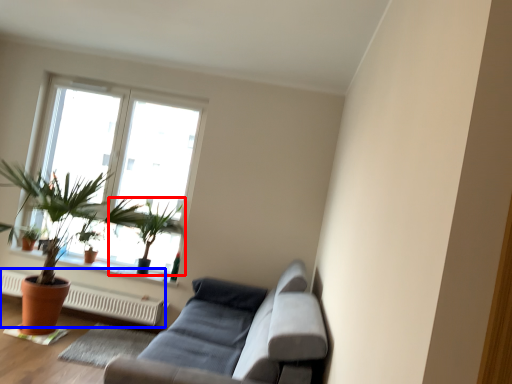
Question: Which of the following is the closest to the observer, houseplant (highlighted by a red box) or heater (highlighted by a blue box)?

Choices:
 (A) houseplant
 (B) heater

Answer: (B)